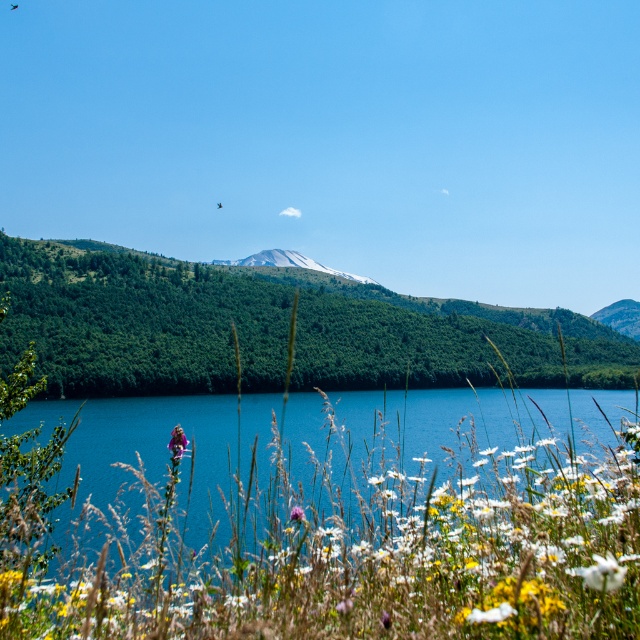
Question: Is blue water at center bigger than smooth gray rock at upper right?

Choices:
 (A) yes
 (B) no

Answer: (A)

Question: Is green leafy hillside at center below blue water at center?

Choices:
 (A) yes
 (B) no

Answer: (B)

Question: Estimate the real-world distances between objects in this image. Which object is farther from the white fluffy flower at lower center?

Choices:
 (A) white fluffy flower at center
 (B) smooth gray rock at upper right
 (C) snowy rock mountain at center

Answer: (B)

Question: Does white fluffy flower at lower center have a smaller size compared to white fluffy flower at center?

Choices:
 (A) yes
 (B) no

Answer: (B)

Question: Which point is closer to the camera?

Choices:
 (A) (408, 445)
 (B) (624, 310)

Answer: (A)

Question: Which point is closer to the camera?

Choices:
 (A) (637, 304)
 (B) (276, 252)

Answer: (B)